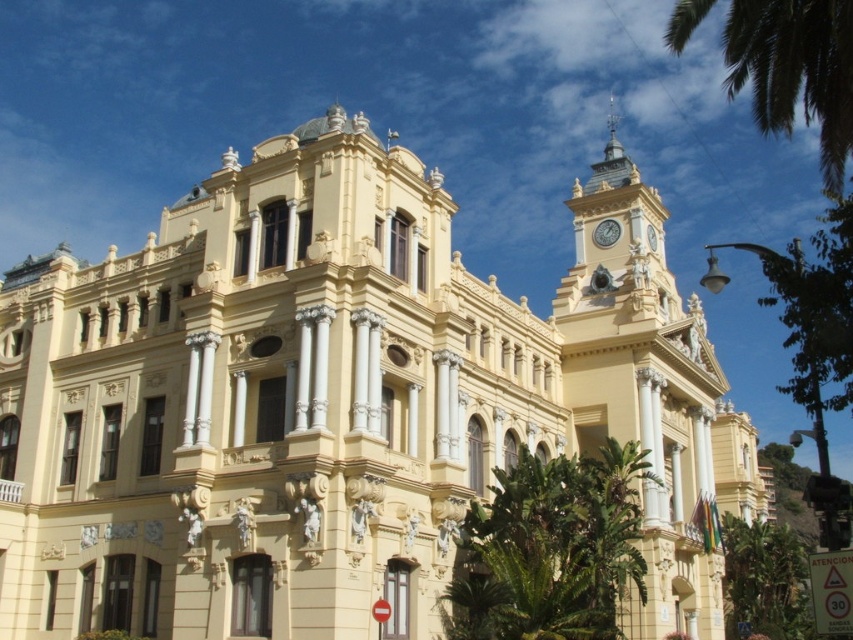
Question: Which point is farther to the camera?

Choices:
 (A) (612, 236)
 (B) (805, 627)
 (C) (801, 44)

Answer: (B)

Question: Among these points, which one is nearest to the camera?

Choices:
 (A) (822, 176)
 (B) (604, 244)
 (C) (738, 522)

Answer: (A)

Question: Does green leafy palm tree at upper right appear over green leafy palm tree at lower right?

Choices:
 (A) yes
 (B) no

Answer: (A)

Question: Is green leafy palm tree at lower right smaller than metallic clock at upper right?

Choices:
 (A) yes
 (B) no

Answer: (B)

Question: Which point appears closest to the camera in this image?

Choices:
 (A) (729, 596)
 (B) (612, 225)

Answer: (B)

Question: Is green leafy palm tree at upper right to the right of green leafy palm tree at lower right from the viewer's perspective?

Choices:
 (A) no
 (B) yes

Answer: (B)